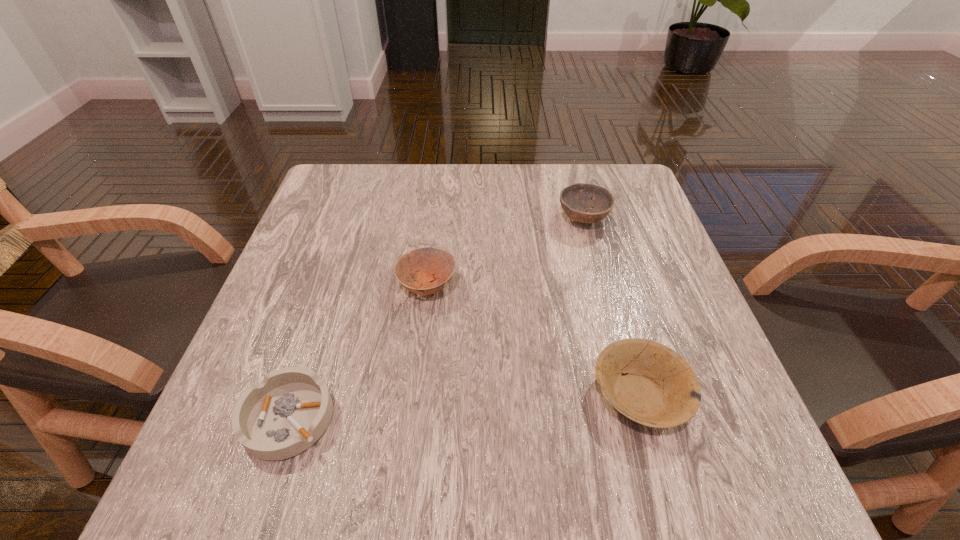
The width and height of the screenshot is (960, 540). I want to click on free space between the ashtray and the farthest object, so click(x=436, y=318).

This screenshot has width=960, height=540. Find the location of `vacant space in between the leftmost bowl and the ashtray`. vacant space in between the leftmost bowl and the ashtray is located at coordinates (358, 352).

At what (x,y) coordinates should I click in order to perform the action: click on free spot between the leftmost object and the second object from left to right. Please return your answer as a coordinate pair (x, y). Looking at the image, I should click on (358, 352).

I want to click on object that can be found as the second closest to the nearest bowl, so click(576, 199).

Identify the location of the second closest object to the third object from right to left. (576, 199).

The height and width of the screenshot is (540, 960). Find the location of `bowl object that ranks as the second closest to the farthest object`. bowl object that ranks as the second closest to the farthest object is located at coordinates (658, 388).

Where is `bowl that can be found as the closest to the ashtray`? The image size is (960, 540). bowl that can be found as the closest to the ashtray is located at coordinates (435, 266).

Locate an element on the screen. This screenshot has height=540, width=960. vacant region that satisfies the following two spatial constraints: 1. on the back side of the third object from right to left; 2. on the left side of the farthest bowl is located at coordinates (435, 219).

Find the location of a particular element. This screenshot has height=540, width=960. free space that satisfies the following two spatial constraints: 1. on the back side of the nearest bowl; 2. on the right side of the ashtray is located at coordinates (296, 395).